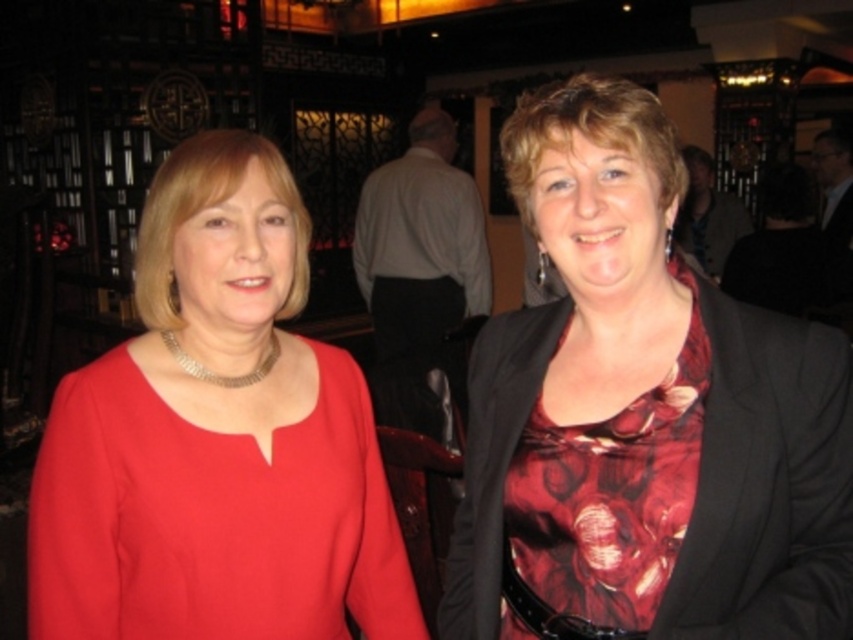
Question: Is floral silk blouse at center below floral satin dress at center?

Choices:
 (A) yes
 (B) no

Answer: (B)

Question: Does matte gold necklace at center come in front of floral satin dress at center?

Choices:
 (A) yes
 (B) no

Answer: (B)

Question: Considering the real-world distances, which object is farthest from the matte gold necklace at center?

Choices:
 (A) floral silk blouse at center
 (B) floral satin dress at center

Answer: (B)

Question: Does floral silk blouse at center appear on the right side of floral satin dress at center?

Choices:
 (A) no
 (B) yes

Answer: (B)

Question: Which point is closer to the camera taking this photo?

Choices:
 (A) (679, 420)
 (B) (746, 333)

Answer: (A)

Question: Which of the following is the farthest from the observer?

Choices:
 (A) matte gold necklace at center
 (B) floral silk blouse at center

Answer: (A)